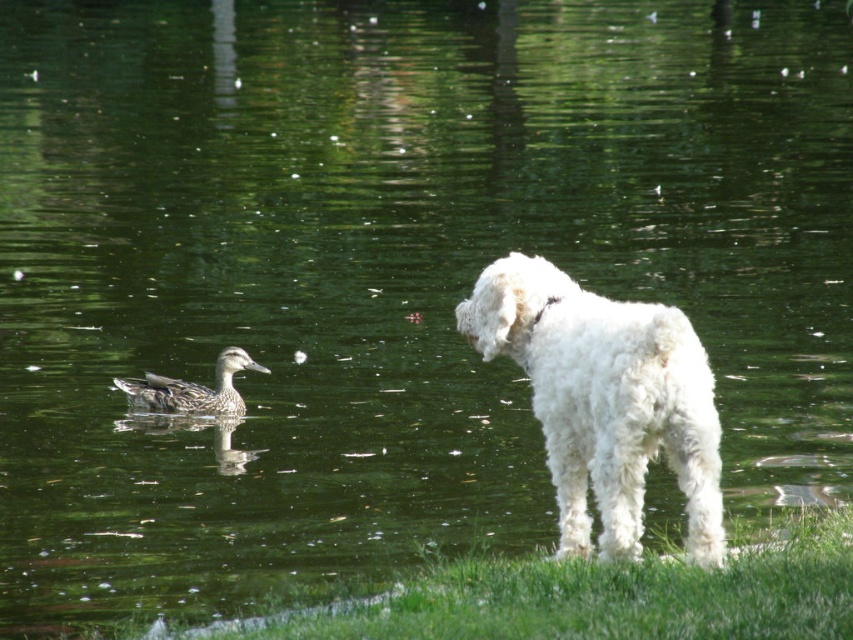
You are a photographer trying to capture a photo of the white fluffy dog at center and the brown speckled duck at left. Based on their positions, which one would appear larger in the photo?

The white fluffy dog at center would appear larger in the photo because it is closer to the viewer than the brown speckled duck at left.

You are a photographer trying to capture a picture of the white fluffy dog at center and the green grass at lower right. Which object is smaller in the image?

The white fluffy dog at center is smaller than the green grass at lower right.